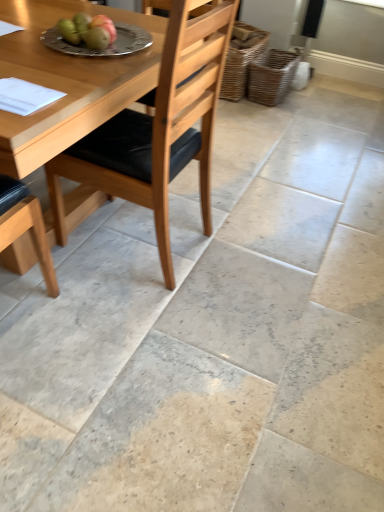
Question: Which direction should I rotate to face woven brown basket at center, which is the 2th basket from right to left, — up or down?

Choices:
 (A) down
 (B) up

Answer: (B)

Question: Is white paper at upper left at the left side of green matte pear at upper left, which is the first fruit in right-to-left order?

Choices:
 (A) no
 (B) yes

Answer: (B)

Question: Considering the relative sizes of white paper at upper left and green matte pear at upper left, which appears as the 2th fruit when viewed from the left, in the image provided, is white paper at upper left bigger than green matte pear at upper left, which appears as the 2th fruit when viewed from the left,?

Choices:
 (A) no
 (B) yes

Answer: (B)

Question: Would you say green matte pear at upper left, which appears as the 2th fruit when viewed from the left, is part of white paper at upper left's contents?

Choices:
 (A) yes
 (B) no

Answer: (B)

Question: Is white paper at upper left positioned with its back to green matte pear at upper left, which is the first fruit in right-to-left order?

Choices:
 (A) no
 (B) yes

Answer: (A)

Question: Is white paper at upper left wider than green matte pear at upper left, which appears as the 2th fruit when viewed from the left?

Choices:
 (A) no
 (B) yes

Answer: (B)

Question: From a real-world perspective, is white paper at upper left located beneath green matte pear at upper left, which appears as the 2th fruit when viewed from the left?

Choices:
 (A) yes
 (B) no

Answer: (A)

Question: Would you consider woven brown basket at center, the 1th basket viewed from the left, to be distant from woven brown basket at lower right, arranged as the first basket when viewed from the right?

Choices:
 (A) yes
 (B) no

Answer: (B)

Question: Is woven brown basket at lower right, arranged as the first basket when viewed from the right, located within woven brown basket at center, which is the 2th basket from right to left?

Choices:
 (A) yes
 (B) no

Answer: (B)

Question: Is woven brown basket at center, the 1th basket viewed from the left, facing away from woven brown basket at lower right, the 2th basket positioned from the left?

Choices:
 (A) yes
 (B) no

Answer: (B)

Question: Is woven brown basket at center, which is the 2th basket from right to left, next to woven brown basket at lower right, the 2th basket positioned from the left?

Choices:
 (A) no
 (B) yes

Answer: (A)

Question: From a real-world perspective, is woven brown basket at center, which is the 2th basket from right to left, located beneath woven brown basket at lower right, arranged as the first basket when viewed from the right?

Choices:
 (A) no
 (B) yes

Answer: (A)

Question: Is the position of woven brown basket at center, the 1th basket viewed from the left, more distant than that of woven brown basket at lower right, the 2th basket positioned from the left?

Choices:
 (A) no
 (B) yes

Answer: (A)

Question: From a real-world perspective, is silver metallic plate at upper center on top of green matte apple at upper left, which ranks as the first fruit in left-to-right order?

Choices:
 (A) no
 (B) yes

Answer: (A)